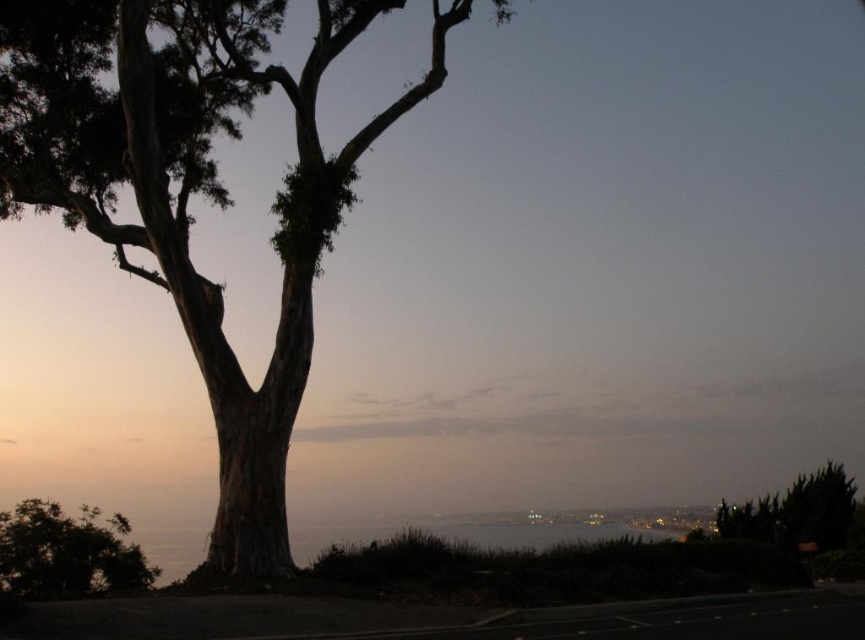
Image resolution: width=865 pixels, height=640 pixels. What are the coordinates of `smooth bark tree at left` in the screenshot? It's located at (193, 189).

Can you confirm if smooth bark tree at left is positioned below green leafy tree at lower left?

No.

What are the coordinates of `smooth bark tree at left` in the screenshot? It's located at (193, 189).